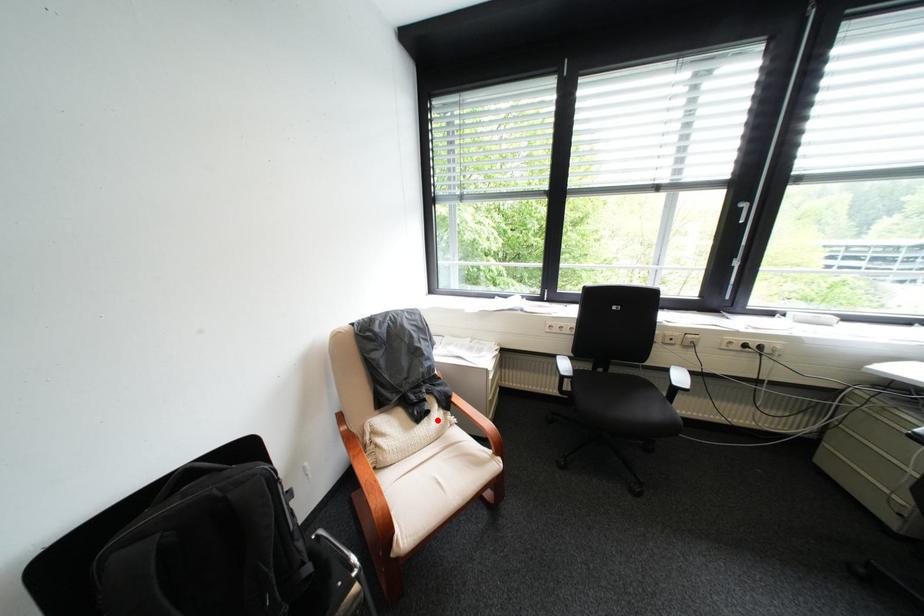
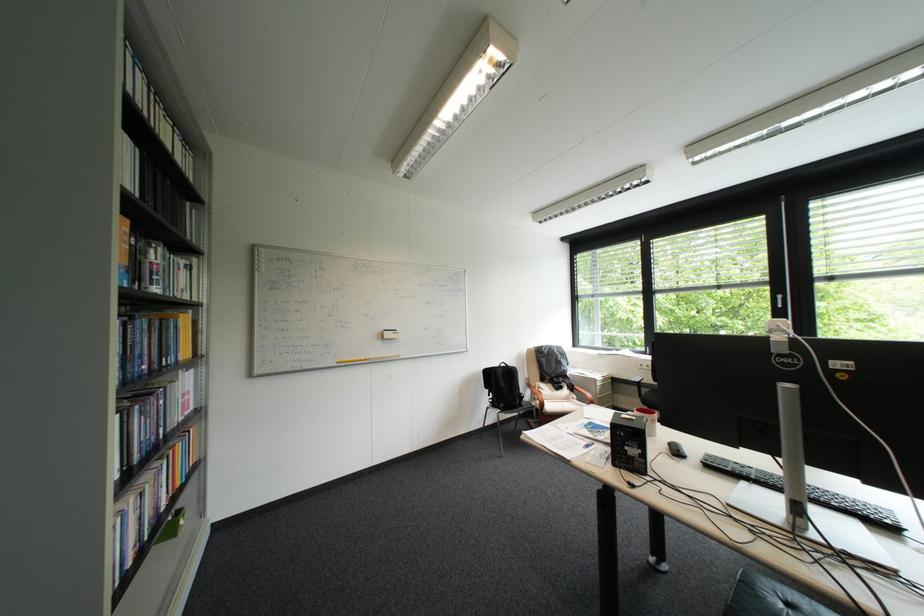
Where in the second image is the point corresponding to the highlighted location from the first image?

(573, 391)